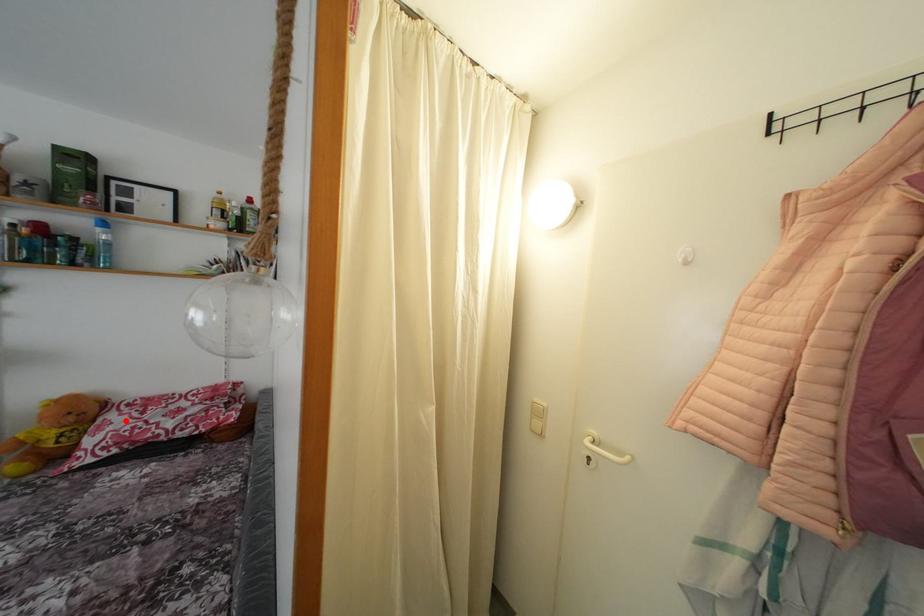
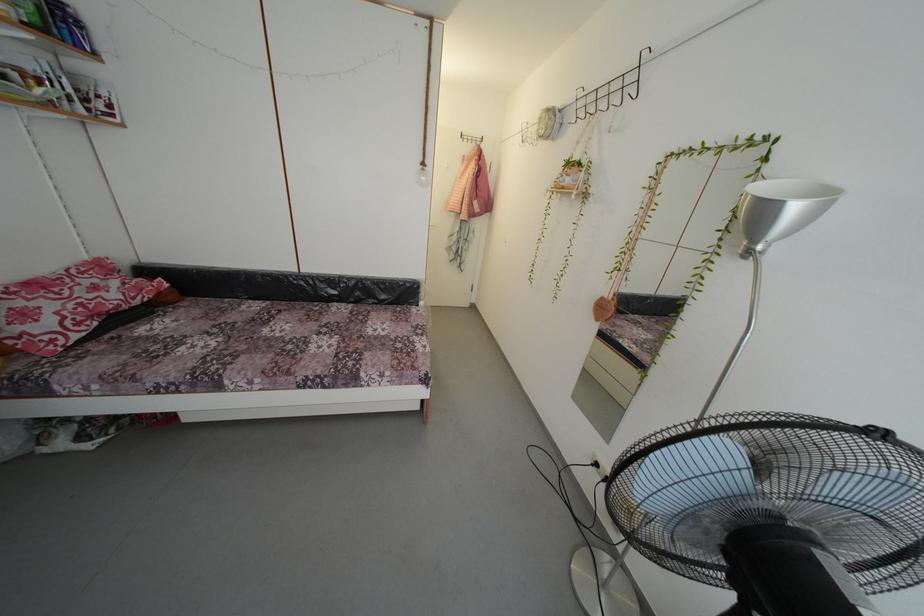
Question: I am providing you with two images of the same scene from different viewpoints. Given a red point in image1, look at the same physical point in image2. Is it:

Choices:
 (A) Closer to the viewpoint
 (B) Farther from the viewpoint

Answer: (B)